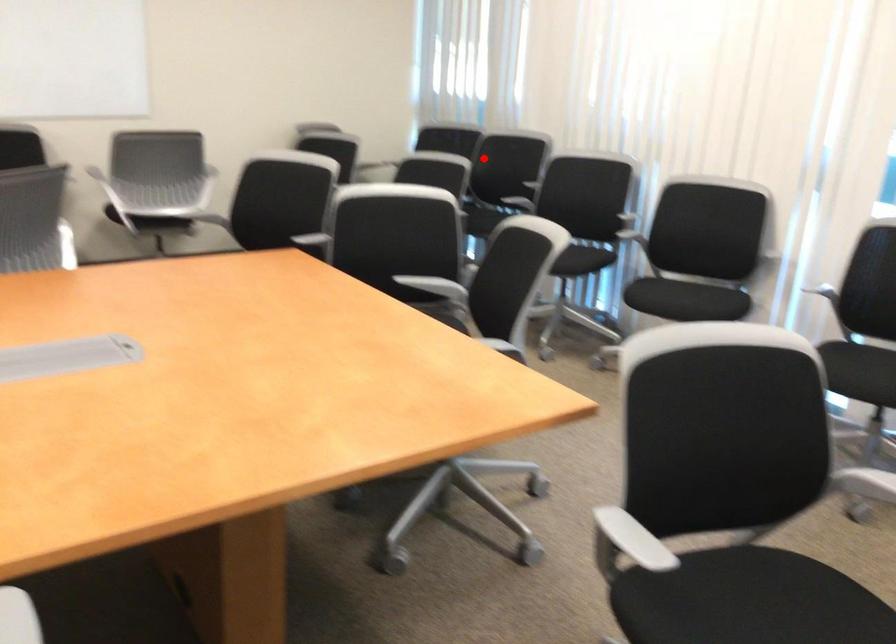
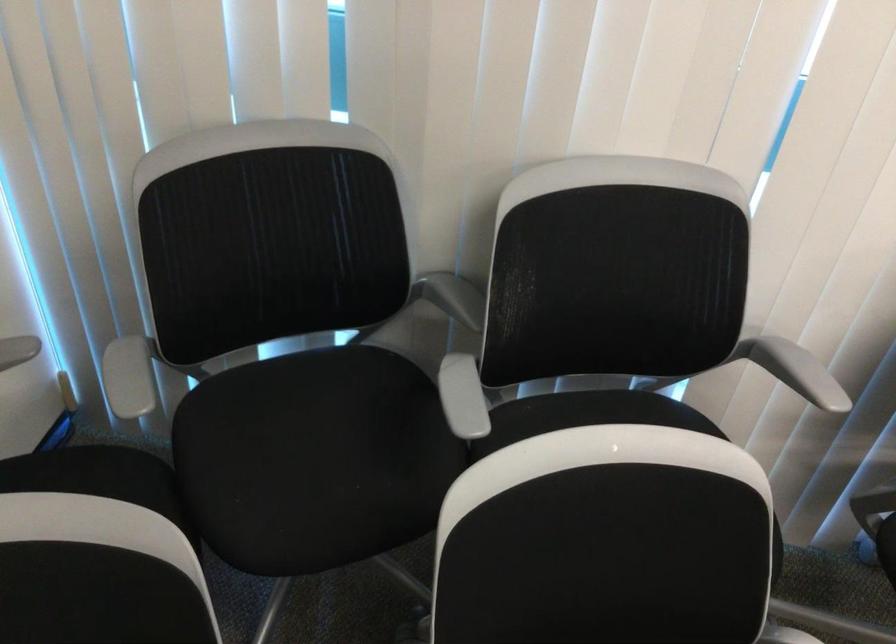
Question: I am providing you with two images of the same scene from different viewpoints. In image1, a red point is highlighted. Considering the same 3D point in image2, which of the following is correct?

Choices:
 (A) It is closer
 (B) It is farther

Answer: (A)